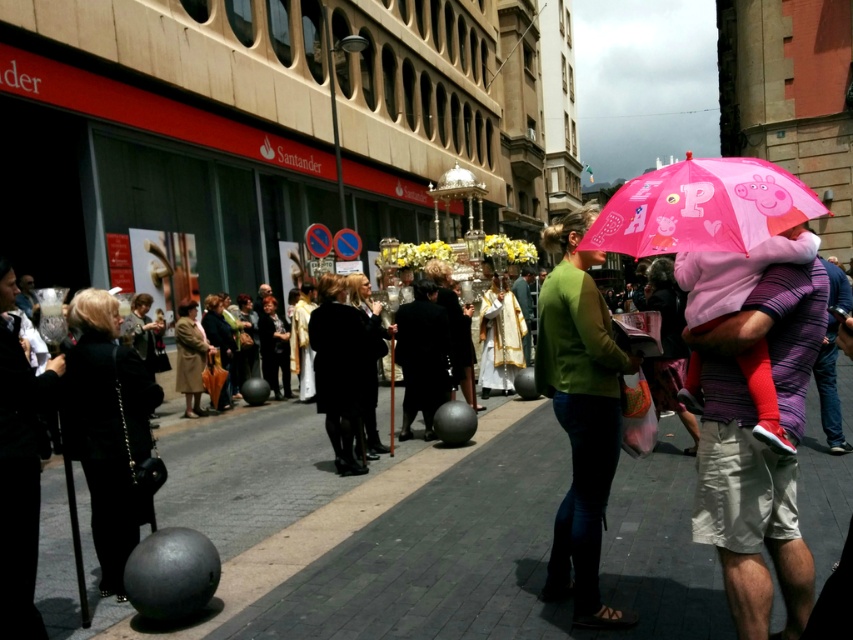
Who is more forward, [564,321] or [86,412]?

Point [564,321] is more forward.

Who is positioned more to the left, green matte sweater at center or black leather jacket at lower left?

black leather jacket at lower left is more to the left.

This screenshot has width=853, height=640. I want to click on green matte sweater at center, so click(579, 413).

Locate an element on the screen. The width and height of the screenshot is (853, 640). green matte sweater at center is located at coordinates (579, 413).

Can you confirm if pink fabric umbrella at right is wider than pink fabric umbrella at upper right?

No, pink fabric umbrella at right is not wider than pink fabric umbrella at upper right.

Is pink fabric umbrella at right positioned in front of pink fabric umbrella at upper right?

No, pink fabric umbrella at right is further to the viewer.

This screenshot has width=853, height=640. What do you see at coordinates (757, 448) in the screenshot?
I see `pink fabric umbrella at right` at bounding box center [757, 448].

Locate an element on the screen. This screenshot has height=640, width=853. pink fabric umbrella at right is located at coordinates (757, 448).

Between point (91, 390) and point (10, 545), which one is positioned behind?

The point (91, 390) is behind.

Is black leather jacket at lower left shorter than black fabric purse at left?

In fact, black leather jacket at lower left may be taller than black fabric purse at left.

Who is more forward, (109, 400) or (10, 385)?

Positioned in front is point (10, 385).

I want to click on black leather jacket at lower left, so click(x=108, y=429).